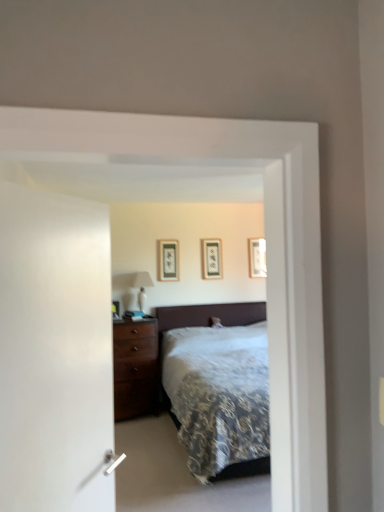
Question: In the image, is matte black picture frame at center, the second picture frame positioned from the left, on the left side or the right side of wooden picture frame at upper right, which appears as the 1th picture frame when viewed from the back?

Choices:
 (A) right
 (B) left

Answer: (B)

Question: In terms of width, does matte black picture frame at center, the 2th picture frame from the back, look wider or thinner when compared to wooden picture frame at upper right, which appears as the 1th picture frame when viewed from the back?

Choices:
 (A) wide
 (B) thin

Answer: (A)

Question: Estimate the real-world distances between objects in this image. Which object is closer to the white glossy table lamp at left?

Choices:
 (A) matte black picture frame at center, which is the third picture frame in back-to-front order
 (B) matte black picture frame at center, the 2th picture frame from the back
 (C) wooden picture frame at upper right, the third picture frame in the front-to-back sequence

Answer: (A)

Question: Which is nearer to the white glossy table lamp at left?

Choices:
 (A) matte black picture frame at center, placed as the second picture frame when sorted from front to back
 (B) matte black picture frame at center, which is counted as the 1th picture frame, starting from the left
 (C) wooden picture frame at upper right, marked as the first picture frame in a right-to-left arrangement

Answer: (B)